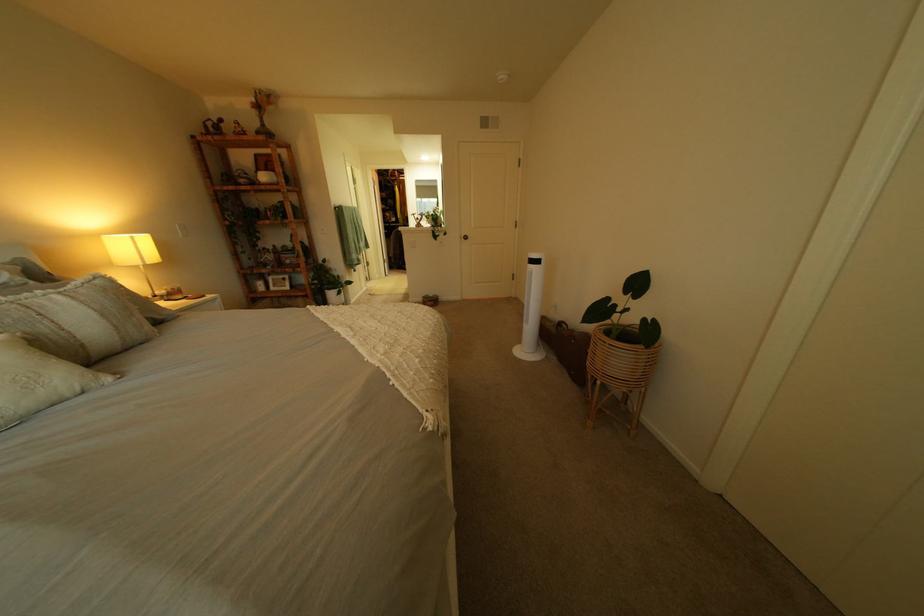
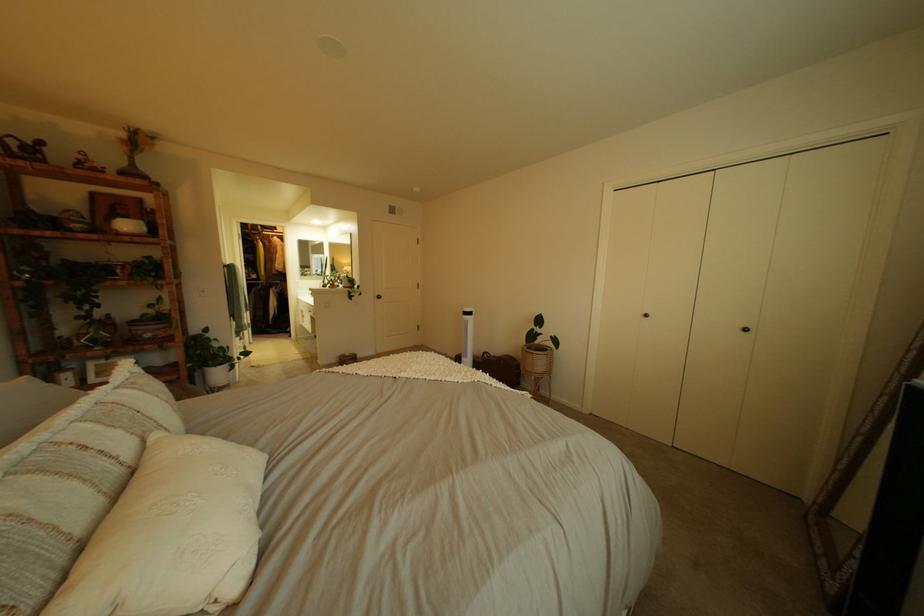
Locate, in the second image, the point that corresponds to the point at 411,174 in the first image.

(274, 228)